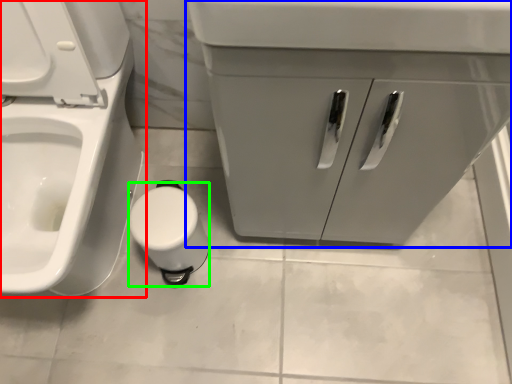
Question: Which is farther away from toilet (highlighted by a red box)? bathroom cabinet (highlighted by a blue box) or toilet paper (highlighted by a green box)?

Choices:
 (A) bathroom cabinet
 (B) toilet paper

Answer: (A)